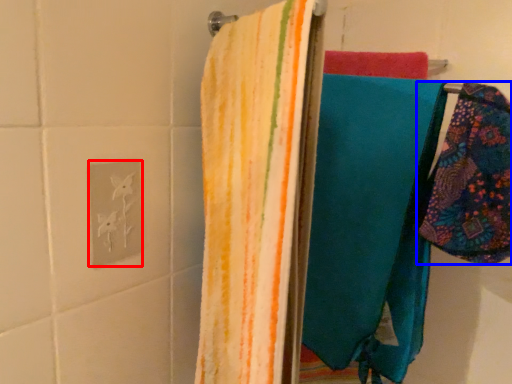
Question: Which of the following is the farthest to the observer, electric outlet (highlighted by a red box) or towel (highlighted by a blue box)?

Choices:
 (A) electric outlet
 (B) towel

Answer: (A)